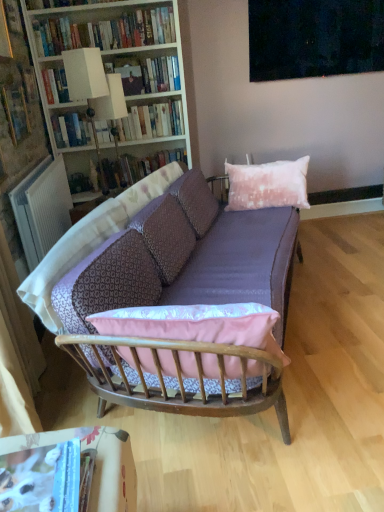
Question: In the image, is hardcover book at upper center, placed as the fourth book when sorted from front to back, positioned in front of or behind white wood bookcase at upper left?

Choices:
 (A) front
 (B) behind

Answer: (B)

Question: Is hardcover book at upper center, the 2th book in the top-to-bottom sequence, taller or shorter than white wood bookcase at upper left?

Choices:
 (A) short
 (B) tall

Answer: (A)

Question: Considering the real-world distances, which object is farthest from the white fabric lampshade at upper left, the second lamp when ordered from back to front?

Choices:
 (A) dark matte painting at upper center
 (B) white wood bookcase at upper left
 (C) hardcover book at center, positioned as the fifth book in top-to-bottom order
 (D) white paper book at lower left, acting as the 1th book starting from the bottom
 (E) hardcover book at upper left, which ranks as the third book in bottom-to-top order

Answer: (D)

Question: Which object is positioned closest to the white wood bookcase at upper left?

Choices:
 (A) hardcover book at center, which appears as the 1th book when viewed from the back
 (B) hardcover books at upper left, which appears as the first book when viewed from the top
 (C) white fabric lampshade at upper left, which is the 1th lamp from back to front
 (D) white fabric lampshade at upper left, the second lamp when ordered from back to front
 (E) hardcover book at upper center, placed as the fourth book when sorted from front to back

Answer: (B)